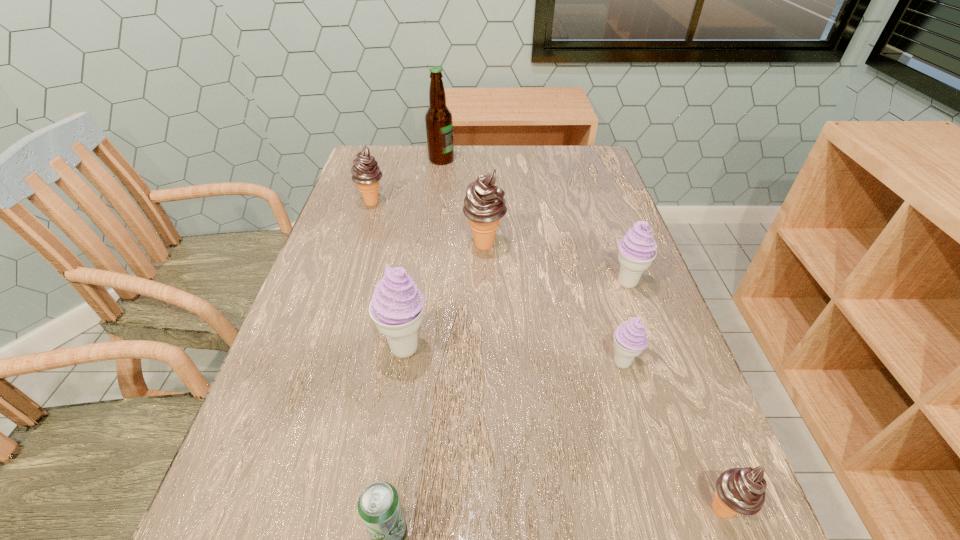
Identify the location of vacant position in the image that satisfies the following two spatial constraints: 1. on the label of the farthest purple icecream; 2. on the right side of the beer bottle. The width and height of the screenshot is (960, 540). (425, 283).

Where is `vacant area in the image that satisfies the following two spatial constraints: 1. on the label of the tallest object; 2. on the left side of the nearest icecream`? The width and height of the screenshot is (960, 540). vacant area in the image that satisfies the following two spatial constraints: 1. on the label of the tallest object; 2. on the left side of the nearest icecream is located at coordinates (396, 509).

Where is `free spot that satisfies the following two spatial constraints: 1. on the front side of the smallest chocolate icecream; 2. on the right side of the seventh nearest object`? This screenshot has height=540, width=960. free spot that satisfies the following two spatial constraints: 1. on the front side of the smallest chocolate icecream; 2. on the right side of the seventh nearest object is located at coordinates (275, 509).